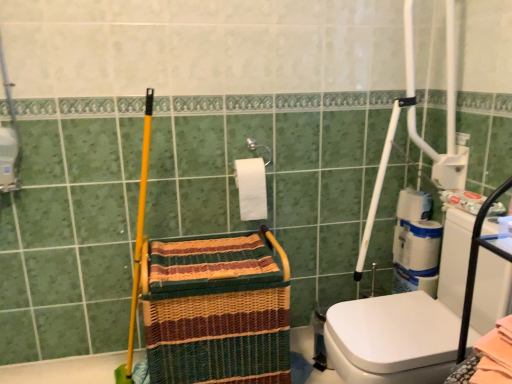
At what (x,y) coordinates should I click in order to perform the action: click on woven straw basket at center. Please return your answer as a coordinate pair (x, y). Looking at the image, I should click on (217, 311).

What is the approximate width of white matte toilet paper at center, the 1th toilet paper in the front-to-back sequence?

4.53 inches.

Find the location of a particular element. woven straw basket at center is located at coordinates (217, 311).

Relative to woven straw basket at center, is white matte toilet paper at center, acting as the 1th toilet paper starting from the left, in front or behind?

Visually, white matte toilet paper at center, acting as the 1th toilet paper starting from the left, is located behind woven straw basket at center.

Considering the positions of point (249, 209) and point (202, 364), is point (249, 209) closer or farther from the camera than point (202, 364)?

Point (249, 209) is farther from the camera than point (202, 364).

In order to click on basket below the white matte toilet paper at center, the 1th toilet paper in the front-to-back sequence (from the image's perspective) in this screenshot , I will do `click(217, 311)`.

From the picture: Measure the distance from white matte toilet paper at center, the 1th toilet paper in the front-to-back sequence, to woven straw basket at center.

white matte toilet paper at center, the 1th toilet paper in the front-to-back sequence, and woven straw basket at center are 14.56 inches apart.

You are a GUI agent. You are given a task and a screenshot of the screen. Output one action in this format:
    pyautogui.click(x=<x>, y=<y>)
    Task: Click on the basket lying in front of the white matte toilet paper at center, which is the second toilet paper in back-to-front order
    The height and width of the screenshot is (384, 512).
    Given the screenshot: What is the action you would take?
    tap(217, 311)

Considering the relative sizes of woven straw basket at center and white matte toilet paper at center, which is the second toilet paper in back-to-front order, in the image provided, is woven straw basket at center thinner than white matte toilet paper at center, which is the second toilet paper in back-to-front order,?

In fact, woven straw basket at center might be wider than white matte toilet paper at center, which is the second toilet paper in back-to-front order.

Considering the positions of objects woven straw basket at center and white matte toilet paper at center, acting as the 1th toilet paper starting from the left, in the image provided, who is more to the left, woven straw basket at center or white matte toilet paper at center, acting as the 1th toilet paper starting from the left,?

woven straw basket at center.

Which of these two, woven straw basket at center or white matte toilet paper at center, the 1th toilet paper in the front-to-back sequence, stands shorter?

white matte toilet paper at center, the 1th toilet paper in the front-to-back sequence, is shorter.

This screenshot has height=384, width=512. Find the location of `toilet paper that is on the right side of white glossy washer at right`. toilet paper that is on the right side of white glossy washer at right is located at coordinates coord(413,205).

How much distance is there between white matte toilet paper at right, the 1th toilet paper viewed from the right, and white glossy washer at right?

The distance of white matte toilet paper at right, the 1th toilet paper viewed from the right, from white glossy washer at right is 18.59 inches.

Considering the relative sizes of white matte toilet paper at right, the 1th toilet paper viewed from the right, and white glossy washer at right in the image provided, is white matte toilet paper at right, the 1th toilet paper viewed from the right, shorter than white glossy washer at right?

Indeed, white matte toilet paper at right, the 1th toilet paper viewed from the right, has a lesser height compared to white glossy washer at right.

Is the surface of white matte toilet paper at right, placed as the 2th toilet paper when sorted from left to right, in direct contact with white glossy washer at right?

white matte toilet paper at right, placed as the 2th toilet paper when sorted from left to right, and white glossy washer at right are clearly separated.

From the picture: Is white matte toilet paper at right, placed as the 2th toilet paper when sorted from left to right, aimed at white matte toilet paper at center, which is the second toilet paper in back-to-front order?

Yes.

Considering the positions of point (413, 203) and point (266, 203), is point (413, 203) closer or farther from the camera than point (266, 203)?

Point (413, 203) is positioned farther from the camera compared to point (266, 203).

Where is `toilet paper on the right of white matte toilet paper at center, the 1th toilet paper in the front-to-back sequence`? Image resolution: width=512 pixels, height=384 pixels. toilet paper on the right of white matte toilet paper at center, the 1th toilet paper in the front-to-back sequence is located at coordinates (413, 205).

Does white matte toilet paper at right, which ranks as the 1th toilet paper in back-to-front order, have a greater height compared to white matte toilet paper at center, the 1th toilet paper in the front-to-back sequence?

In fact, white matte toilet paper at right, which ranks as the 1th toilet paper in back-to-front order, may be shorter than white matte toilet paper at center, the 1th toilet paper in the front-to-back sequence.

Which is more to the left, white glossy washer at right or woven straw basket at center?

woven straw basket at center.

From the image's perspective, is white glossy washer at right positioned above or below woven straw basket at center?

white glossy washer at right is above woven straw basket at center.

Is white glossy washer at right shorter than woven straw basket at center?

No, white glossy washer at right is not shorter than woven straw basket at center.

Is white glossy washer at right in contact with woven straw basket at center?

No, white glossy washer at right is not making contact with woven straw basket at center.

Which point is more forward, (403,214) or (271,360)?

The point (271,360) is more forward.

Can you confirm if white matte toilet paper at right, which ranks as the 1th toilet paper in back-to-front order, is thinner than woven straw basket at center?

Yes.

Is white matte toilet paper at right, placed as the 2th toilet paper when sorted from left to right, bigger than woven straw basket at center?

No.

From the picture: Which is more to the left, white matte toilet paper at right, placed as the 2th toilet paper when sorted from left to right, or woven straw basket at center?

Positioned to the left is woven straw basket at center.

Considering the positions of objects white glossy washer at right and white matte toilet paper at right, placed as the 2th toilet paper when sorted from left to right, in the image provided, who is more to the left, white glossy washer at right or white matte toilet paper at right, placed as the 2th toilet paper when sorted from left to right,?

From the viewer's perspective, white glossy washer at right appears more on the left side.

Is white glossy washer at right oriented towards white matte toilet paper at right, placed as the 2th toilet paper when sorted from left to right?

No, white glossy washer at right is not turned towards white matte toilet paper at right, placed as the 2th toilet paper when sorted from left to right.

Is white glossy washer at right not near white matte toilet paper at right, placed as the 2th toilet paper when sorted from left to right?

That's not correct — white glossy washer at right is a little close to white matte toilet paper at right, placed as the 2th toilet paper when sorted from left to right.

Looking at this image, is white glossy washer at right inside the boundaries of white matte toilet paper at right, placed as the 2th toilet paper when sorted from left to right, or outside?

white glossy washer at right cannot be found inside white matte toilet paper at right, placed as the 2th toilet paper when sorted from left to right.

I want to click on basket that appears below the white matte toilet paper at center, acting as the 1th toilet paper starting from the left (from a real-world perspective), so click(x=217, y=311).

At what (x,y) coordinates should I click in order to perform the action: click on basket in front of the white matte toilet paper at center, acting as the 1th toilet paper starting from the left. Please return your answer as a coordinate pair (x, y). Looking at the image, I should click on (217, 311).

Estimate the real-world distances between objects in this image. Which object is further from white matte toilet paper at center, which is the second toilet paper in back-to-front order, white glossy washer at right or woven straw basket at center?

white glossy washer at right is further to white matte toilet paper at center, which is the second toilet paper in back-to-front order.

Which object lies nearer to the anchor point white glossy washer at right, woven straw basket at center or white matte toilet paper at right, the 1th toilet paper viewed from the right?

Based on the image, woven straw basket at center appears to be nearer to white glossy washer at right.

Estimate the real-world distances between objects in this image. Which object is further from white matte toilet paper at right, placed as the 2th toilet paper when sorted from left to right, woven straw basket at center or white glossy washer at right?

The object further to white matte toilet paper at right, placed as the 2th toilet paper when sorted from left to right, is woven straw basket at center.

Considering their positions, is white matte toilet paper at right, placed as the 2th toilet paper when sorted from left to right, positioned closer to woven straw basket at center than white glossy washer at right?

Among the two, white glossy washer at right is located nearer to woven straw basket at center.

Looking at the image, which one is located closer to white glossy washer at right, white matte toilet paper at center, the second toilet paper when ordered from right to left, or woven straw basket at center?

woven straw basket at center is closer to white glossy washer at right.

From the picture: Which object lies nearer to the anchor point white glossy washer at right, white matte toilet paper at right, placed as the 2th toilet paper when sorted from left to right, or woven straw basket at center?

woven straw basket at center is positioned closer to the anchor white glossy washer at right.

Considering their positions, is white glossy washer at right positioned further to white matte toilet paper at right, placed as the 2th toilet paper when sorted from left to right, than woven straw basket at center?

woven straw basket at center.

When comparing their distances from woven straw basket at center, does white matte toilet paper at right, the 1th toilet paper viewed from the right, or white matte toilet paper at center, the second toilet paper when ordered from right to left, seem closer?

Based on the image, white matte toilet paper at center, the second toilet paper when ordered from right to left, appears to be nearer to woven straw basket at center.

What are the coordinates of `washer between woven straw basket at center and white matte toilet paper at right, which appears as the 2th toilet paper when viewed from the front, in the horizontal direction` in the screenshot? It's located at [x=405, y=323].

Locate an element on the screen. Image resolution: width=512 pixels, height=384 pixels. toilet paper located between woven straw basket at center and white matte toilet paper at right, the 1th toilet paper viewed from the right, in the left-right direction is located at coordinates (251, 188).

Find the location of `toilet paper located between woven straw basket at center and white glossy washer at right in the left-right direction`. toilet paper located between woven straw basket at center and white glossy washer at right in the left-right direction is located at coordinates [x=251, y=188].

Image resolution: width=512 pixels, height=384 pixels. Find the location of `washer situated between white matte toilet paper at center, which is the second toilet paper in back-to-front order, and white matte toilet paper at right, the 1th toilet paper viewed from the right, from left to right`. washer situated between white matte toilet paper at center, which is the second toilet paper in back-to-front order, and white matte toilet paper at right, the 1th toilet paper viewed from the right, from left to right is located at coordinates [x=405, y=323].